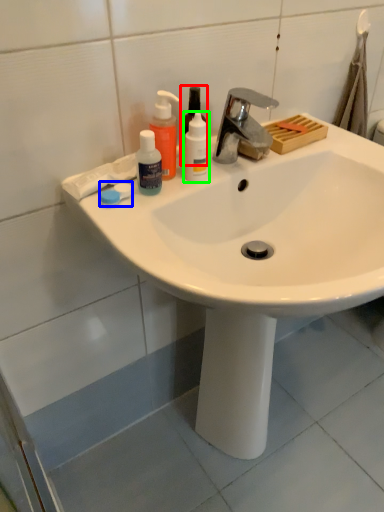
Question: Which object is the closest to the mouthwash (highlighted by a red box)? Choose among these: soap (highlighted by a blue box) or mouthwash (highlighted by a green box).

Choices:
 (A) soap
 (B) mouthwash

Answer: (B)